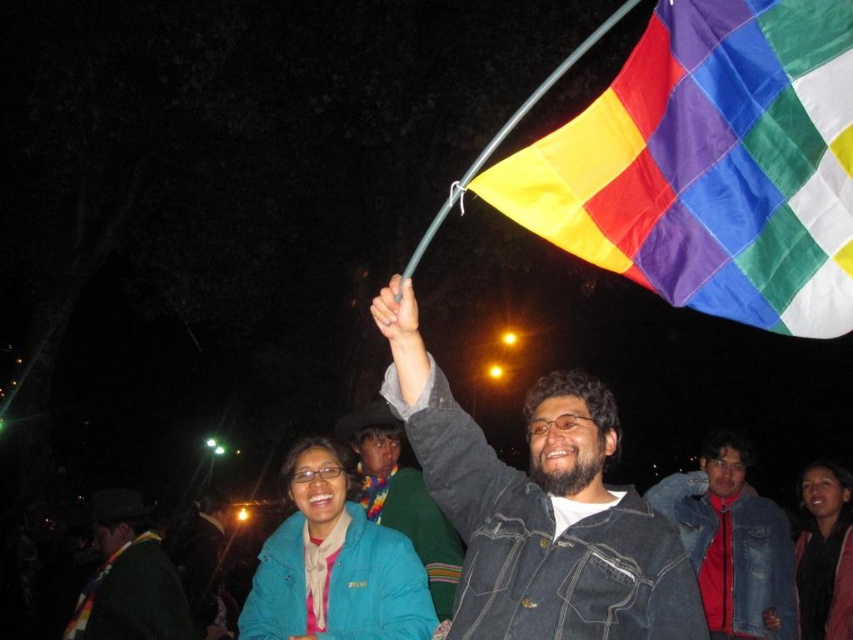
You are standing at the origin of the coordinate system in the image. You see two points, point (x=575, y=241) and point (x=791, y=544). Which point is closer to you?

Point (x=575, y=241) is in front of point (x=791, y=544), so it is closer to you.

You are a photographer trying to capture the polyester rainbow flag at upper right and the denim jacket at lower right in a single frame. Based on their positions, do you think the flag could be wider than the jacket in the photo?

The polyester rainbow flag at upper right might be wider than denim jacket at lower right, so it is possible that the flag appears wider in the photo.